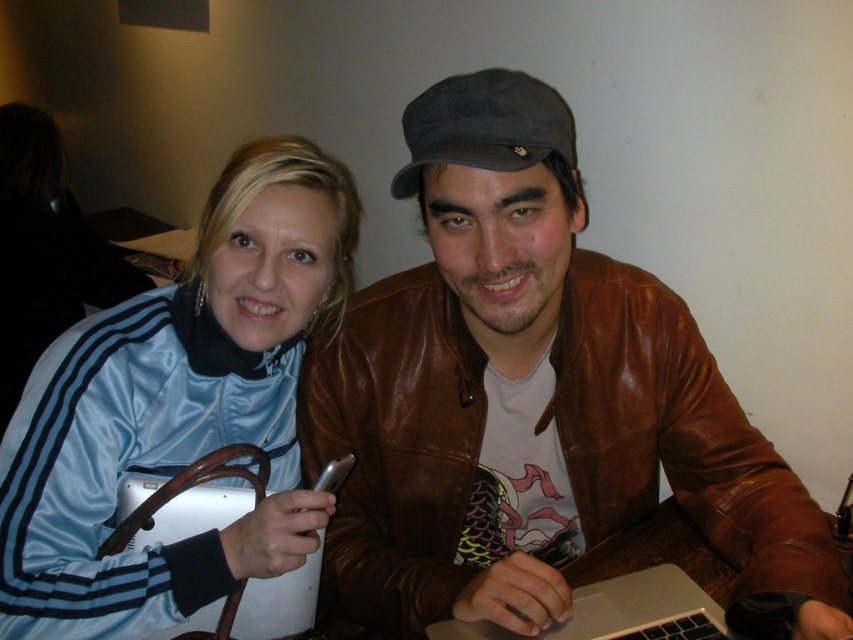
Question: Does satin blue jacket at upper left have a smaller size compared to silver metallic laptop at center?

Choices:
 (A) no
 (B) yes

Answer: (A)

Question: Which point is farther from the camera taking this photo?

Choices:
 (A) (460, 634)
 (B) (477, 429)
 (C) (198, 502)
 (D) (300, 253)

Answer: (C)

Question: Is satin blue jacket at upper left bigger than silver metallic laptop at center?

Choices:
 (A) no
 (B) yes

Answer: (B)

Question: Which of the following is the closest to the observer?

Choices:
 (A) pos(213,188)
 (B) pos(460,461)
 (C) pos(120,522)
 (D) pos(648,596)

Answer: (D)

Question: Which object is the farthest from the brown leather jacket at center?

Choices:
 (A) white matte laptop at center
 (B) satin blue jacket at upper left
 (C) silver metallic laptop at center

Answer: (A)

Question: Does satin blue jacket at upper left lie in front of white matte laptop at center?

Choices:
 (A) yes
 (B) no

Answer: (A)